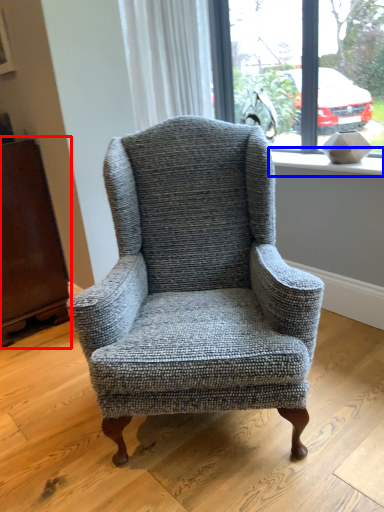
Question: Which object is closer to the camera taking this photo, armoire (highlighted by a red box) or window sill (highlighted by a blue box)?

Choices:
 (A) armoire
 (B) window sill

Answer: (B)